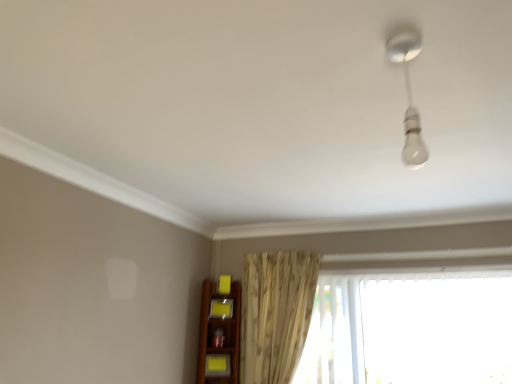
Question: In terms of size, does beige textured curtain at center appear bigger or smaller than transparent plastic window at lower right?

Choices:
 (A) small
 (B) big

Answer: (A)

Question: In the image, is beige textured curtain at center positioned in front of or behind transparent plastic window at lower right?

Choices:
 (A) front
 (B) behind

Answer: (B)

Question: Which of these objects is positioned closest to the beige textured curtain at center?

Choices:
 (A) white glossy bulb at upper right
 (B) matte yellow shelf at lower center, positioned as the 2th shelf in back-to-front order
 (C) yellow matte shelf at lower center, acting as the first shelf starting from the top
 (D) transparent plastic window at lower right

Answer: (C)

Question: Which object is positioned closest to the white glossy bulb at upper right?

Choices:
 (A) matte yellow shelf at lower center, which is the first shelf in front-to-back order
 (B) yellow matte shelf at lower center, which appears as the first shelf when viewed from the back
 (C) transparent plastic window at lower right
 (D) beige textured curtain at center

Answer: (C)